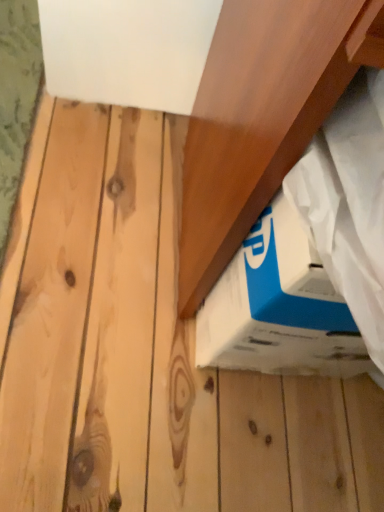
You are a GUI agent. You are given a task and a screenshot of the screen. Output one action in this format:
    pyautogui.click(x=<x>, y=<y>)
    Task: Click on the free region on the left part of wooden at upper right
    This screenshot has width=384, height=512.
    Given the screenshot: What is the action you would take?
    pyautogui.click(x=99, y=185)